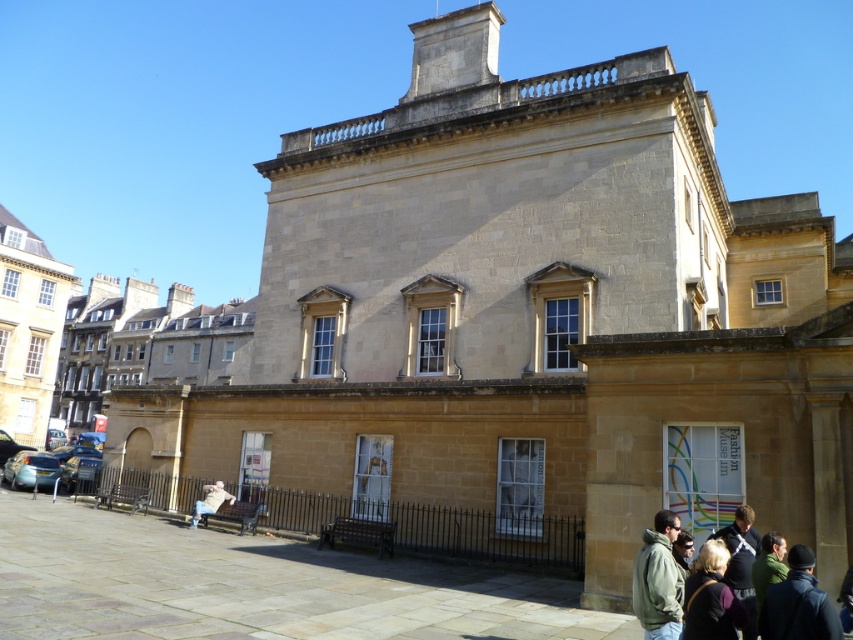
Which of these two, green fabric jacket at lower right or dark green jacket at lower right, stands taller?

green fabric jacket at lower right is taller.

Is green fabric jacket at lower right smaller than dark green jacket at lower right?

Actually, green fabric jacket at lower right might be larger than dark green jacket at lower right.

Between point (799, 620) and point (677, 534), which one is positioned in front?

Point (799, 620) is more forward.

Locate an element on the screen. green fabric jacket at lower right is located at coordinates (798, 604).

Who is positioned more to the left, green fleece jacket at lower right or dark green jacket at lower right?

green fleece jacket at lower right is more to the left.

Can you confirm if green fleece jacket at lower right is taller than dark green jacket at lower right?

No.

Image resolution: width=853 pixels, height=640 pixels. Describe the element at coordinates (659, 579) in the screenshot. I see `green fleece jacket at lower right` at that location.

Identify the location of green fleece jacket at lower right. (659, 579).

Is green fleece jacket at lower right positioned in front of dark brown leather jacket at lower right?

That is False.

Image resolution: width=853 pixels, height=640 pixels. Describe the element at coordinates (659, 579) in the screenshot. I see `green fleece jacket at lower right` at that location.

Identify the location of green fleece jacket at lower right. This screenshot has width=853, height=640. (659, 579).